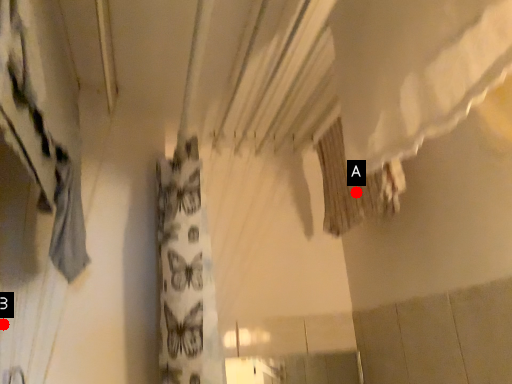
Question: Two points are circled on the image, labeled by A and B beside each circle. Which of the following is the farthest from the observer?

Choices:
 (A) A is further
 (B) B is further

Answer: (A)